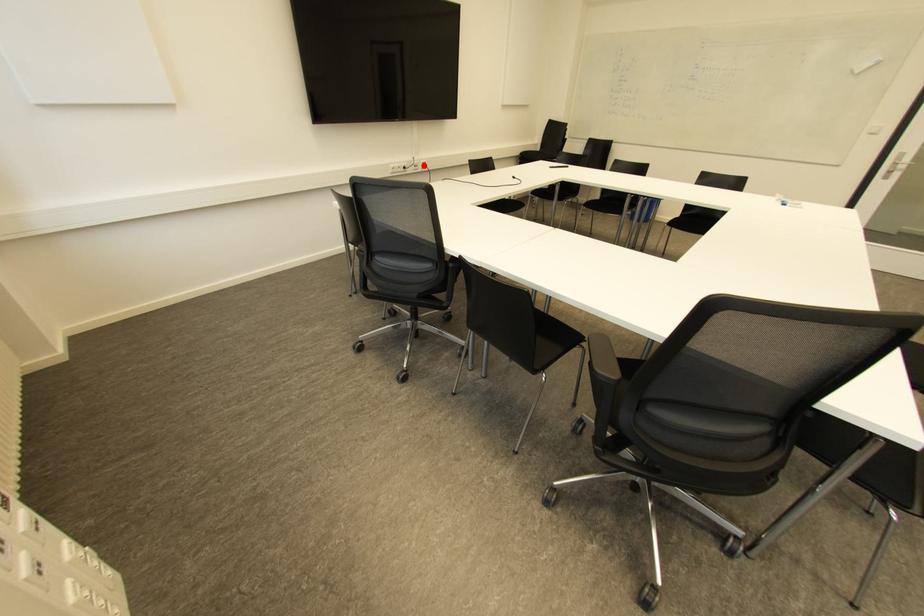
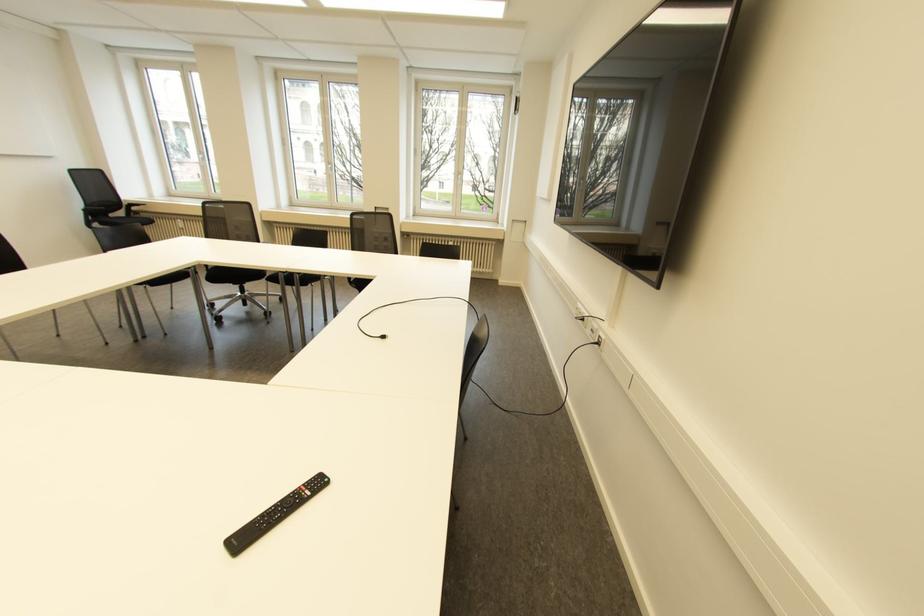
Where in the second image is the point corresponding to the highlighted location from the first image?

(598, 342)